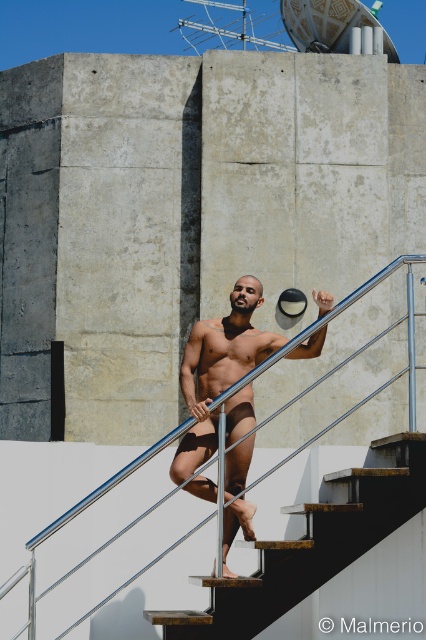
You are standing at the base of the staircase and want to reach the top. The wooden stair at center is 44.79 meters from viewer. Can you estimate how many steps you need to climb to reach the top?

The wooden stair at center is 44.79 meters from viewer, but without knowing the height of each step, it is impossible to determine the exact number of steps needed to reach the top.

You are a maintenance worker needing to reach the silver metallic rail at upper center from the wooden stair at center. Given that your ladder is 8 meters long, will it be sufficient to bridge the gap between them?

The wooden stair at center and silver metallic rail at upper center are 9.46 meters apart. Since the ladder is only 8 meters long, it will not be long enough to bridge the gap between the wooden stair at center and the silver metallic rail at upper center.